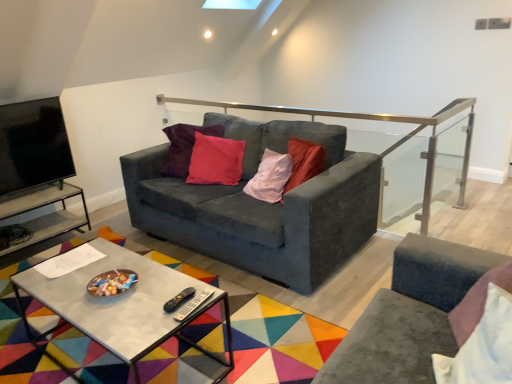
Question: Considering the relative sizes of satin silver rail at upper center and velvet dark gray couch at center in the image provided, is satin silver rail at upper center thinner than velvet dark gray couch at center?

Choices:
 (A) no
 (B) yes

Answer: (B)

Question: Can you confirm if satin silver rail at upper center is smaller than velvet dark gray couch at center?

Choices:
 (A) no
 (B) yes

Answer: (B)

Question: Is satin silver rail at upper center positioned beyond the bounds of velvet dark gray couch at center?

Choices:
 (A) no
 (B) yes

Answer: (A)

Question: Considering the relative positions of satin silver rail at upper center and velvet dark gray couch at center in the image provided, is satin silver rail at upper center to the left of velvet dark gray couch at center from the viewer's perspective?

Choices:
 (A) yes
 (B) no

Answer: (B)

Question: Would you say satin silver rail at upper center contains velvet dark gray couch at center?

Choices:
 (A) no
 (B) yes

Answer: (A)

Question: Based on their positions, is metal/glass side table at left located to the left or right of satin silver rail at upper center?

Choices:
 (A) left
 (B) right

Answer: (A)

Question: Looking at the image, does metal/glass side table at left seem bigger or smaller compared to satin silver rail at upper center?

Choices:
 (A) small
 (B) big

Answer: (A)

Question: Is metal/glass side table at left taller or shorter than satin silver rail at upper center?

Choices:
 (A) short
 (B) tall

Answer: (A)

Question: Considering the positions of metal/glass side table at left and satin silver rail at upper center in the image, is metal/glass side table at left wider or thinner than satin silver rail at upper center?

Choices:
 (A) wide
 (B) thin

Answer: (A)

Question: Considering the positions of satin silver rail at upper center and concrete rectangular table at center in the image, is satin silver rail at upper center taller or shorter than concrete rectangular table at center?

Choices:
 (A) short
 (B) tall

Answer: (B)

Question: Is satin silver rail at upper center situated inside concrete rectangular table at center or outside?

Choices:
 (A) inside
 (B) outside

Answer: (B)

Question: Does point (428, 175) appear closer or farther from the camera than point (96, 332)?

Choices:
 (A) closer
 (B) farther

Answer: (B)

Question: Considering the positions of satin silver rail at upper center and concrete rectangular table at center in the image, is satin silver rail at upper center bigger or smaller than concrete rectangular table at center?

Choices:
 (A) big
 (B) small

Answer: (A)

Question: Is point (416, 215) closer or farther from the camera than point (370, 192)?

Choices:
 (A) closer
 (B) farther

Answer: (B)

Question: Is satin silver rail at upper center to the left or to the right of velvet dark gray couch at center in the image?

Choices:
 (A) left
 (B) right

Answer: (B)